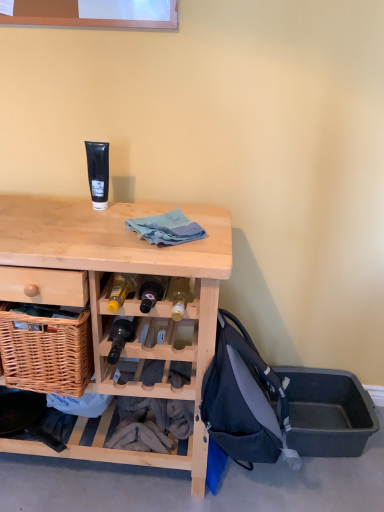
Where is `vacant space positioned to the left of black matte tube at upper center`? The height and width of the screenshot is (512, 384). vacant space positioned to the left of black matte tube at upper center is located at coordinates (x=56, y=208).